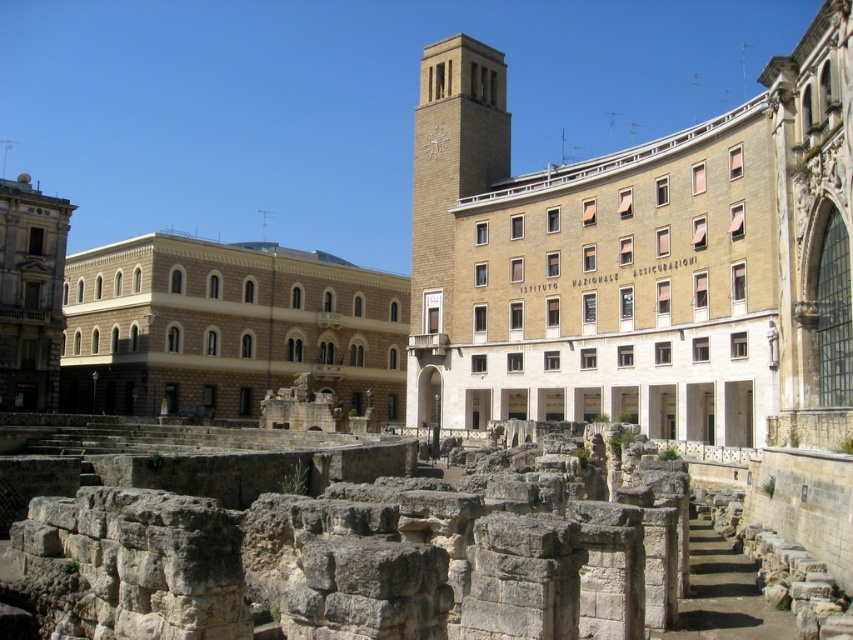
You are an architect planning to place a new sculpture between the brown stone amphitheater at center and the beige stone clock tower at center. The sculpture requires a minimum of 10 meters of space between the two structures to be placed safely. Given their widths, can the sculpture be placed between them?

The brown stone amphitheater at center is wider than the beige stone clock tower at center. However, the exact widths are not provided, so we cannot determine if the space between them meets the 10 meter requirement. Additional measurements are needed.

You are standing at the origin point of a coordinate system placed over the image. The origin is at the bottom left corner of the image. The x and y axes increase to the right and up respectively. You want to locate the brown stone amphitheater at center. What are its coordinates?

The coordinates of the brown stone amphitheater at center are at point (225, 326).

You are standing at the point labeled as point (x=225, y=326) in the image. Based on the scene description, what ancient structure are you currently located on?

You are standing on the brown stone amphitheater at center.